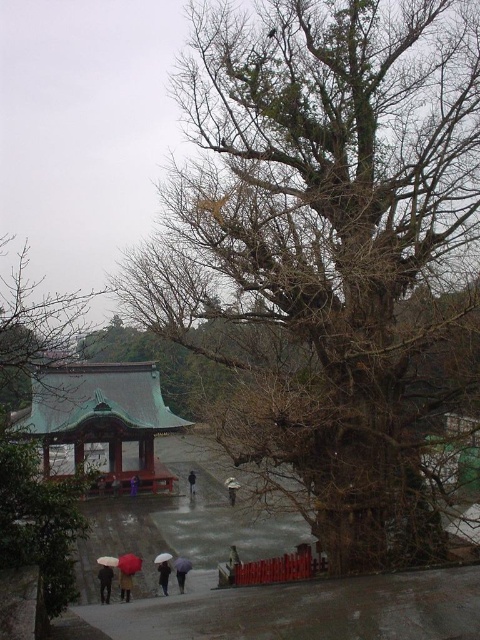
Question: Can you confirm if bronze/golden gazebo at lower left is positioned above dark gray fabric umbrella at lower center?

Choices:
 (A) yes
 (B) no

Answer: (A)

Question: Which of the following is the farthest from the observer?

Choices:
 (A) (101, 579)
 (B) (158, 561)
 (C) (8, 432)

Answer: (B)

Question: Can you confirm if light purple fabric umbrella at lower center is positioned above red matte umbrella at lower left?

Choices:
 (A) yes
 (B) no

Answer: (A)

Question: Among these points, which one is farthest from the camera?

Choices:
 (A) (139, 570)
 (B) (162, 557)

Answer: (B)

Question: Which point is closer to the camera?

Choices:
 (A) white matte umbrella at lower center
 (B) bare wood tree at center
 (C) dark gray umbrella at center
 (D) matte black umbrella at lower left

Answer: (B)

Question: Considering the relative positions of bare wood tree at center and red matte umbrella at lower left in the image provided, where is bare wood tree at center located with respect to red matte umbrella at lower left?

Choices:
 (A) left
 (B) right

Answer: (B)